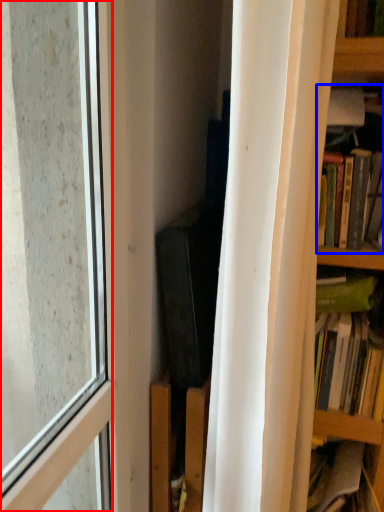
Question: Among these objects, which one is farthest to the camera, window (highlighted by a red box) or book (highlighted by a blue box)?

Choices:
 (A) window
 (B) book

Answer: (B)